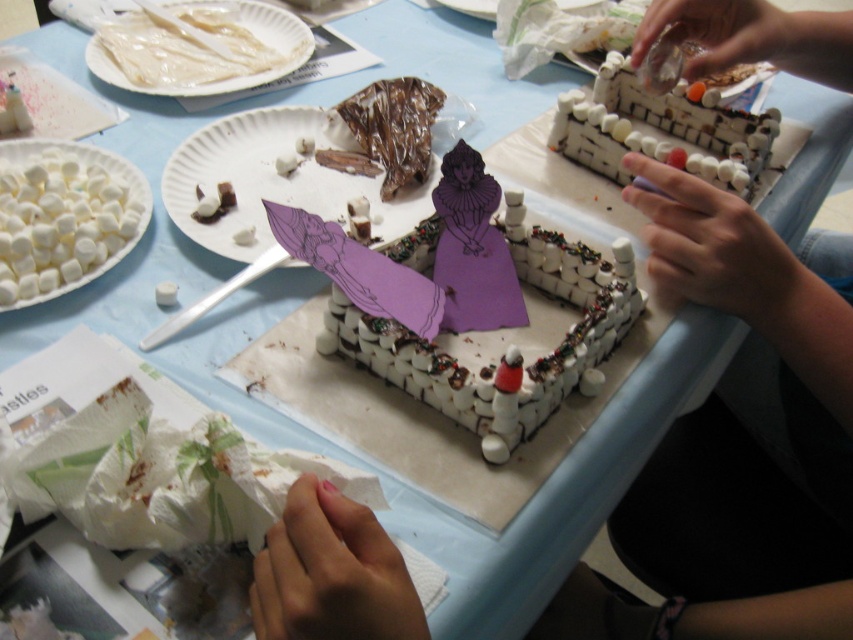
You are a child trying to place a tiny flag on the marshmallow castle. You have two points to choose from, point A at coordinates point (x=302, y=176) and point B at coordinates point (x=200, y=211). Which point is closer to you so you can easily reach it?

Point (x=302, y=176) is further to the viewer than point (x=200, y=211), so point B at coordinates point (x=200, y=211) is closer to you and easier to reach.

You are a child trying to build a marshmallow tower. You have two white marshmallows at left and a white marshmallow at center. Which marshmallow is higher up?

The white marshmallows at left are higher up than the white marshmallow at center because the white marshmallows at left is above white marshmallow at center.